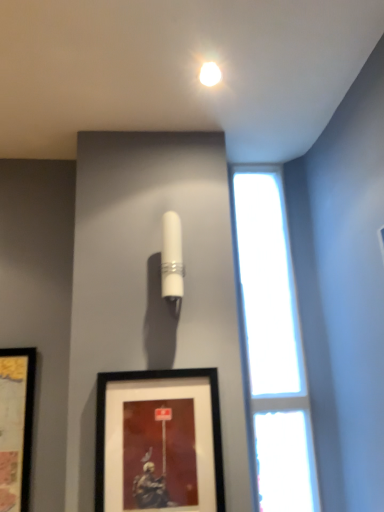
Question: Is white glossy cylinder at upper center thinner than transparent glass window at right?

Choices:
 (A) no
 (B) yes

Answer: (A)

Question: Is white glossy cylinder at upper center at the left side of transparent glass window at right?

Choices:
 (A) yes
 (B) no

Answer: (A)

Question: Considering the relative positions of white glossy cylinder at upper center and transparent glass window at right in the image provided, is white glossy cylinder at upper center in front of transparent glass window at right?

Choices:
 (A) no
 (B) yes

Answer: (B)

Question: Considering the relative sizes of white glossy cylinder at upper center and transparent glass window at right in the image provided, is white glossy cylinder at upper center bigger than transparent glass window at right?

Choices:
 (A) no
 (B) yes

Answer: (A)

Question: From a real-world perspective, does white glossy cylinder at upper center stand above transparent glass window at right?

Choices:
 (A) yes
 (B) no

Answer: (A)

Question: In terms of width, does black matte picture frame at lower center look wider or thinner when compared to white glossy cylinder at upper center?

Choices:
 (A) thin
 (B) wide

Answer: (A)

Question: Is black matte picture frame at lower center to the left or to the right of white glossy cylinder at upper center in the image?

Choices:
 (A) left
 (B) right

Answer: (A)

Question: Relative to white glossy cylinder at upper center, is black matte picture frame at lower center in front or behind?

Choices:
 (A) behind
 (B) front

Answer: (B)

Question: Considering the positions of black matte picture frame at lower center and white glossy cylinder at upper center in the image, is black matte picture frame at lower center taller or shorter than white glossy cylinder at upper center?

Choices:
 (A) short
 (B) tall

Answer: (B)

Question: Looking at the image, does black matte picture frame at lower center seem bigger or smaller compared to matte white light bulb at upper center?

Choices:
 (A) small
 (B) big

Answer: (B)

Question: In the image, is black matte picture frame at lower center positioned in front of or behind matte white light bulb at upper center?

Choices:
 (A) front
 (B) behind

Answer: (A)

Question: Considering the positions of black matte picture frame at lower center and matte white light bulb at upper center in the image, is black matte picture frame at lower center taller or shorter than matte white light bulb at upper center?

Choices:
 (A) short
 (B) tall

Answer: (B)

Question: From a real-world perspective, is black matte picture frame at lower center physically located above or below matte white light bulb at upper center?

Choices:
 (A) below
 (B) above

Answer: (A)

Question: In the image, is matte white light bulb at upper center positioned in front of or behind black matte picture frame at lower center?

Choices:
 (A) behind
 (B) front

Answer: (A)

Question: Considering the positions of matte white light bulb at upper center and black matte picture frame at lower center in the image, is matte white light bulb at upper center wider or thinner than black matte picture frame at lower center?

Choices:
 (A) wide
 (B) thin

Answer: (A)